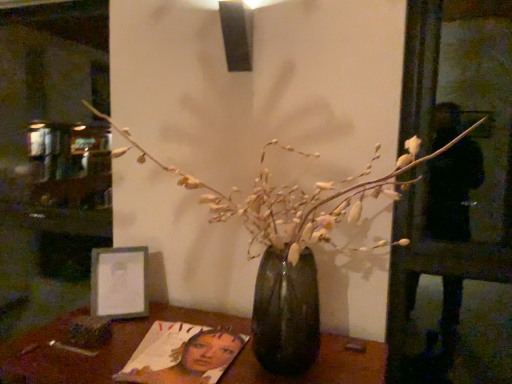
Question: Is wooden table at center in front of or behind metallic silver frame at lower left in the image?

Choices:
 (A) behind
 (B) front

Answer: (B)

Question: Looking at the image, does wooden table at center seem bigger or smaller compared to metallic silver frame at lower left?

Choices:
 (A) big
 (B) small

Answer: (A)

Question: Based on their relative distances, which object is nearer to the translucent glass vase at center?

Choices:
 (A) matte paper magazine at lower center
 (B) metallic silver frame at lower left
 (C) wooden table at center

Answer: (A)

Question: Estimate the real-world distances between objects in this image. Which object is farther from the matte paper magazine at lower center?

Choices:
 (A) translucent glass vase at center
 (B) metallic silver frame at lower left
 (C) wooden table at center

Answer: (A)